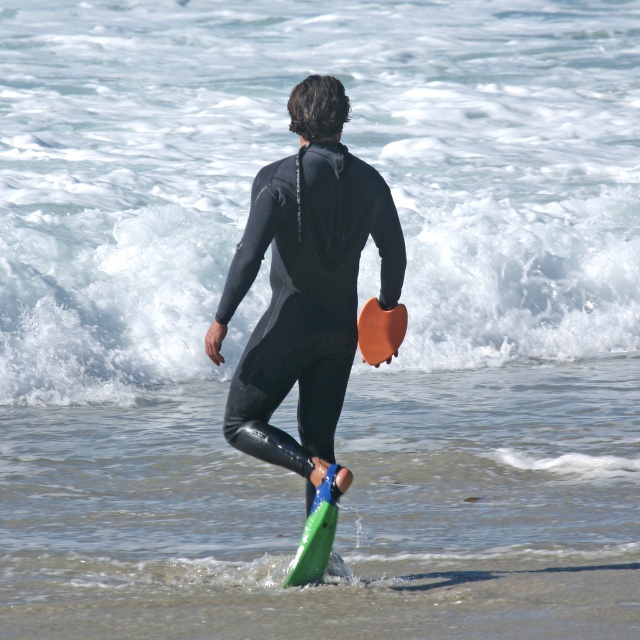
Locate an element on the screen. This screenshot has width=640, height=640. green rubber surfboard at lower center is located at coordinates (316, 532).

The width and height of the screenshot is (640, 640). What do you see at coordinates (316, 532) in the screenshot?
I see `green rubber surfboard at lower center` at bounding box center [316, 532].

The height and width of the screenshot is (640, 640). I want to click on green rubber surfboard at lower center, so click(316, 532).

Between white frothy wave at upper center and orange matte surfboard at lower center, which one appears on the left side from the viewer's perspective?

Positioned to the left is orange matte surfboard at lower center.

Locate an element on the screen. white frothy wave at upper center is located at coordinates (113, 285).

Locate an element on the screen. The height and width of the screenshot is (640, 640). white frothy wave at upper center is located at coordinates (113, 285).

Which is more to the right, white frothy wave at upper center or black matte wetsuit at center?

Positioned to the right is white frothy wave at upper center.

Does white frothy wave at upper center appear on the left side of black matte wetsuit at center?

No, white frothy wave at upper center is not to the left of black matte wetsuit at center.

Image resolution: width=640 pixels, height=640 pixels. What are the coordinates of `white frothy wave at upper center` in the screenshot? It's located at 113,285.